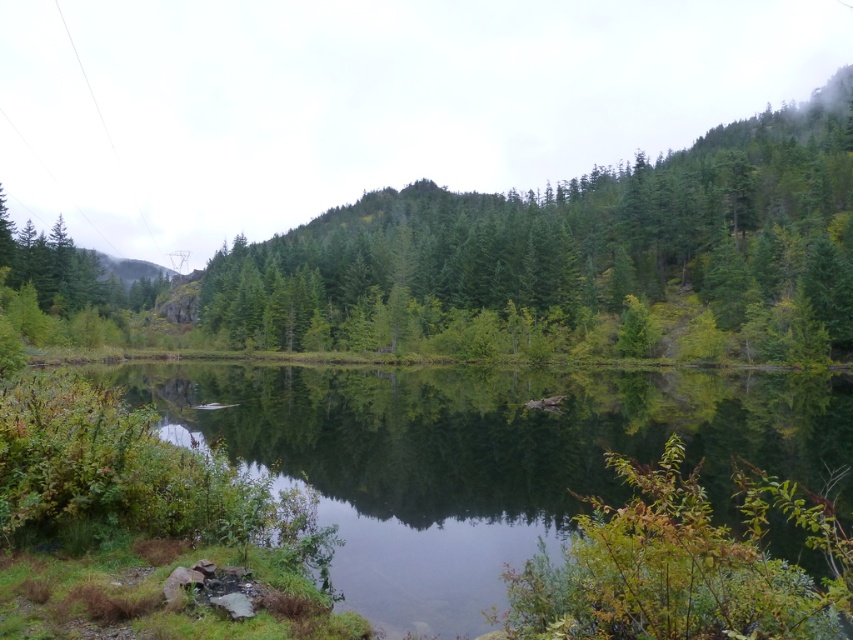
You are an artist trying to paint the scene. You notice the green glossy water at center and the green matte tree at center. Which object should you paint first if you want to follow the rule of painting smaller objects before larger ones?

The green glossy water at center is smaller than the green matte tree at center, so you should paint the green glossy water at center first.